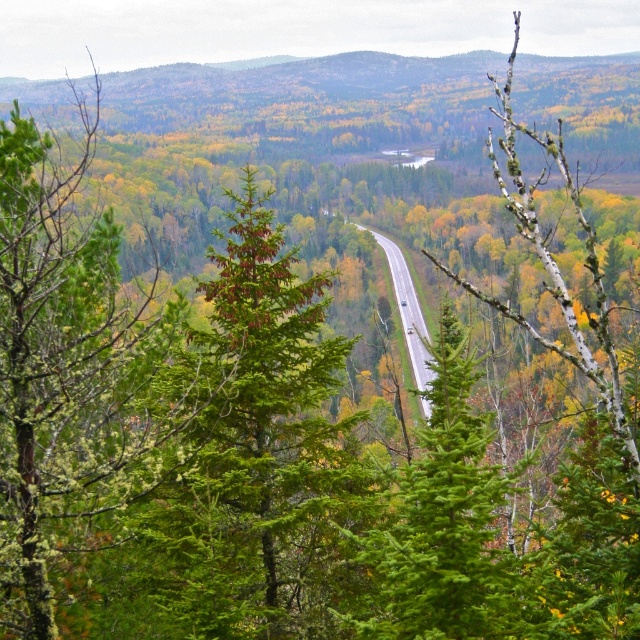
Question: Which point is closer to the camera taking this photo?

Choices:
 (A) (464, 406)
 (B) (403, 273)
 (C) (260, 368)

Answer: (C)

Question: Does green needle-like tree at center have a greater width compared to asphalt road at center?

Choices:
 (A) yes
 (B) no

Answer: (B)

Question: Which object is farther from the camera taking this photo?

Choices:
 (A) green leafy tree at center
 (B) asphalt road at center

Answer: (B)

Question: Is green needle-like tree at center below green leafy tree at center?

Choices:
 (A) yes
 (B) no

Answer: (B)

Question: Among these objects, which one is farthest from the camera?

Choices:
 (A) asphalt road at center
 (B) green leafy tree at center
 (C) green needle-like tree at center

Answer: (A)

Question: Is green leafy tree at center above asphalt road at center?

Choices:
 (A) no
 (B) yes

Answer: (A)